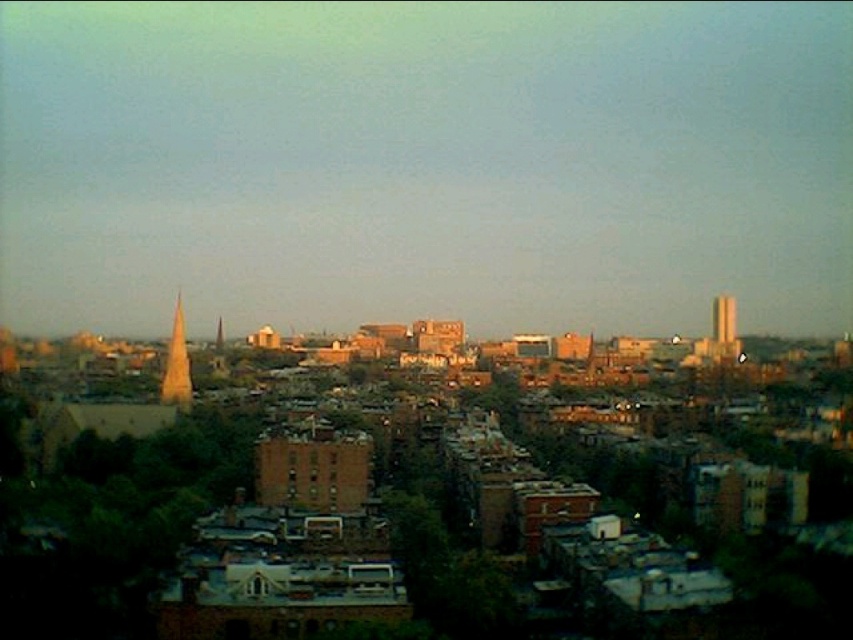
You are an urban planner assessing the skyline of this city. You notice the golden glass spire at left and the brick tower at right. Which structure has a greater width when viewed from this perspective?

The golden glass spire at left has a greater width than the brick tower at right according to the description.

You are an architect evaluating the urban skyline. The golden glass spire at left is part of a new development. Based on its position in the scene, can you determine if it is closer to the horizon or the base of the image?

The golden glass spire at left is located at point coordinates that place it closer to the horizon than the base of the image, as its y coordinate of 0.208 is closer to the top edge of the frame compared to the bottom edge.